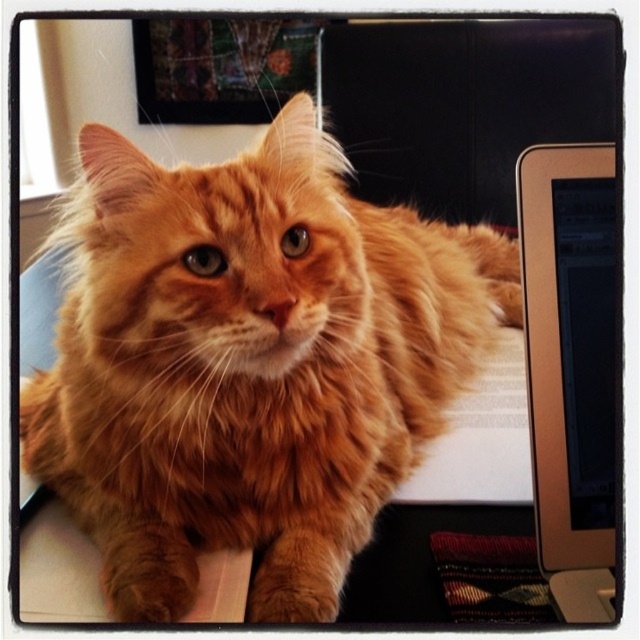
Can you confirm if orange fluffy cat at center is taller than metallic silver monitor at right?

Yes.

I want to click on orange fluffy cat at center, so click(250, 364).

Which is in front, point (282, 589) or point (554, 326)?

Positioned in front is point (554, 326).

You are a GUI agent. You are given a task and a screenshot of the screen. Output one action in this format:
    pyautogui.click(x=<x>, y=<y>)
    Task: Click on the orange fluffy cat at center
    This screenshot has width=640, height=640.
    Given the screenshot: What is the action you would take?
    pyautogui.click(x=250, y=364)